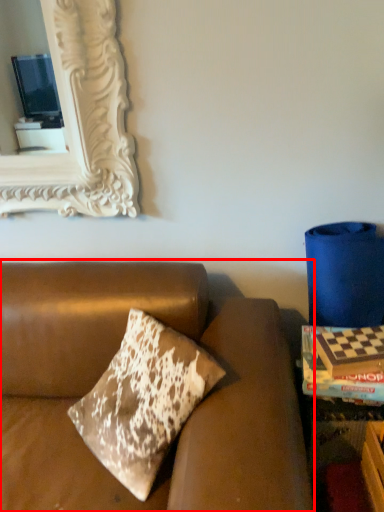
Question: Where is studio couch (annotated by the red box) located in relation to magazine in the image?

Choices:
 (A) left
 (B) right

Answer: (A)